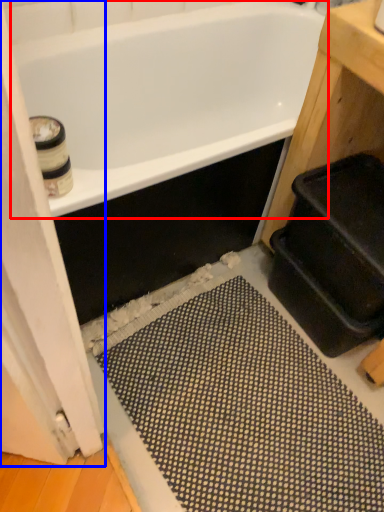
Question: Among these objects, which one is nearest to the camera, bathtub (highlighted by a red box) or screen door (highlighted by a blue box)?

Choices:
 (A) bathtub
 (B) screen door

Answer: (B)